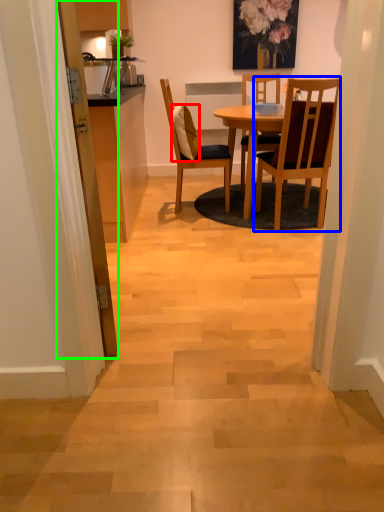
Question: Which object is positioned closest to pillow (highlighted by a red box)? Select from chair (highlighted by a blue box) and door (highlighted by a green box).

Choices:
 (A) chair
 (B) door

Answer: (A)